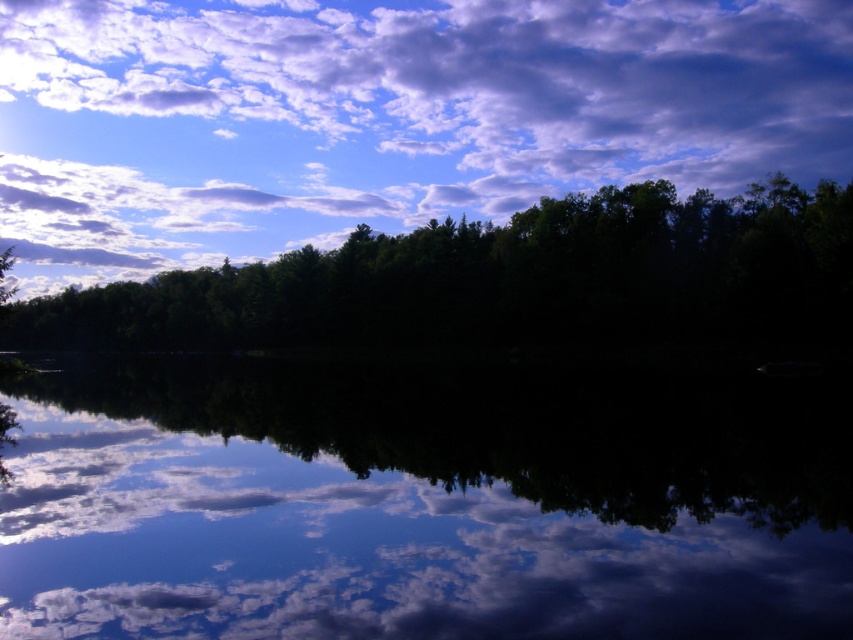
You are a photographer trying to capture the reflection of the white fluffy cloud at upper center and the green matte forest at center in the water. Which object will appear closer to you in the reflection?

The white fluffy cloud at upper center will appear closer to you in the reflection because it is further to the viewer than the green matte forest at center, making its reflection closer to the surface.

You are standing at the edge of the water and notice two points marked in the scene. Which point, point (276,630) or point (318,250), is closer to you?

Point (276,630) is closer to the viewer than point (318,250).